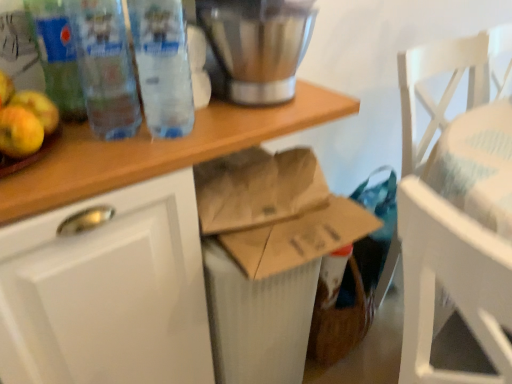
Question: From the image's perspective, is yellow matte apple at left below transparent plastic bottles at upper left, the 3th bottle from the left?

Choices:
 (A) yes
 (B) no

Answer: (A)

Question: Is the depth of yellow matte apple at left less than that of transparent plastic bottles at upper left, arranged as the 1th bottle when viewed from the right?

Choices:
 (A) no
 (B) yes

Answer: (B)

Question: Does yellow matte apple at left have a lesser height compared to transparent plastic bottles at upper left, arranged as the 1th bottle when viewed from the right?

Choices:
 (A) no
 (B) yes

Answer: (B)

Question: Is yellow matte apple at left placed right next to transparent plastic bottles at upper left, the 3th bottle from the left?

Choices:
 (A) yes
 (B) no

Answer: (B)

Question: Can you confirm if yellow matte apple at left is positioned to the left of transparent plastic bottles at upper left, arranged as the 1th bottle when viewed from the right?

Choices:
 (A) no
 (B) yes

Answer: (B)

Question: Considering the positions of transparent plastic bottle at upper left, the 2th bottle in the right-to-left sequence, and translucent plastic bottle at left, the 1th bottle when ordered from left to right, in the image, is transparent plastic bottle at upper left, the 2th bottle in the right-to-left sequence, wider or thinner than translucent plastic bottle at left, the 1th bottle when ordered from left to right,?

Choices:
 (A) thin
 (B) wide

Answer: (B)

Question: Which is correct: transparent plastic bottle at upper left, acting as the 2th bottle starting from the left, is inside translucent plastic bottle at left, the 1th bottle when ordered from left to right, or outside of it?

Choices:
 (A) inside
 (B) outside

Answer: (B)

Question: Would you say transparent plastic bottle at upper left, the 2th bottle in the right-to-left sequence, is to the left or to the right of translucent plastic bottle at left, the 1th bottle when ordered from left to right, in the picture?

Choices:
 (A) left
 (B) right

Answer: (B)

Question: Based on their sizes in the image, would you say transparent plastic bottle at upper left, the 2th bottle in the right-to-left sequence, is bigger or smaller than translucent plastic bottle at left, the 1th bottle when ordered from left to right?

Choices:
 (A) big
 (B) small

Answer: (A)

Question: In terms of size, does stainless steel blender at upper center appear bigger or smaller than translucent plastic bottle at left, the 1th bottle when ordered from left to right?

Choices:
 (A) small
 (B) big

Answer: (B)

Question: Is stainless steel blender at upper center spatially inside translucent plastic bottle at left, the 1th bottle when ordered from left to right, or outside of it?

Choices:
 (A) inside
 (B) outside

Answer: (B)

Question: Is stainless steel blender at upper center to the left or to the right of translucent plastic bottle at left, the 1th bottle when ordered from left to right, in the image?

Choices:
 (A) left
 (B) right

Answer: (B)

Question: Is stainless steel blender at upper center in front of or behind translucent plastic bottle at left, the 1th bottle when ordered from left to right, in the image?

Choices:
 (A) front
 (B) behind

Answer: (B)

Question: Is brown paper bag at center inside or outside of stainless steel blender at upper center?

Choices:
 (A) inside
 (B) outside

Answer: (B)

Question: In the image, is brown paper bag at center on the left side or the right side of stainless steel blender at upper center?

Choices:
 (A) left
 (B) right

Answer: (A)